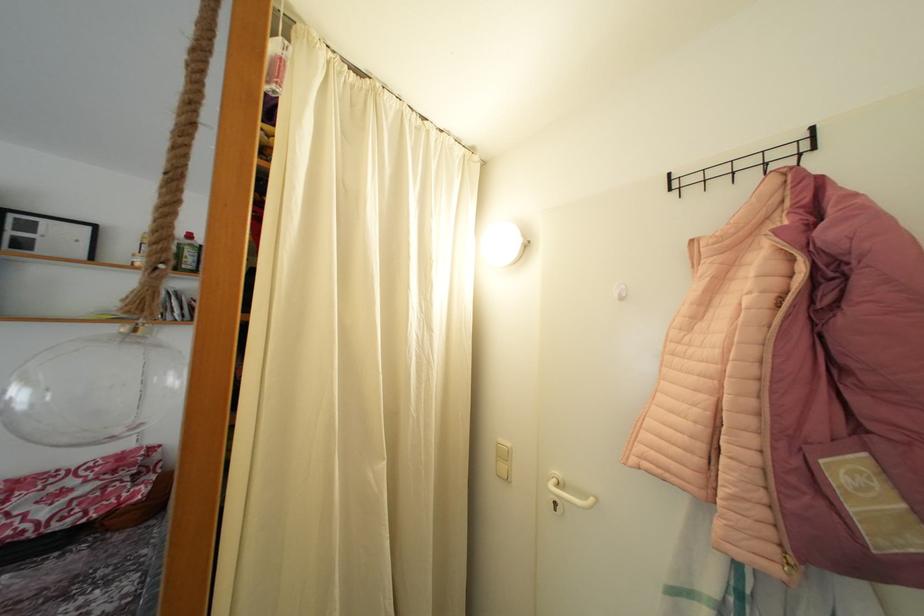
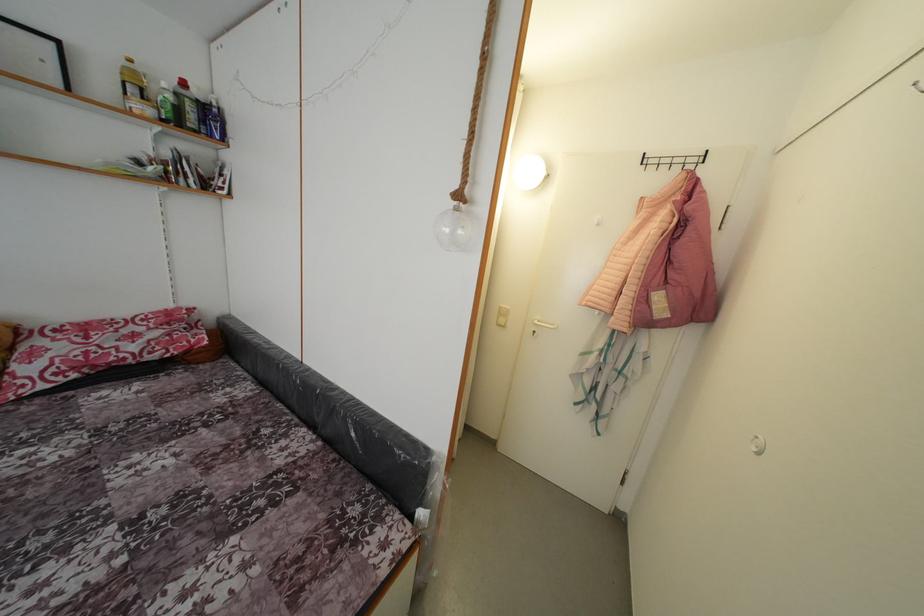
How did the camera likely rotate?

The rotation direction of the camera is right-down.